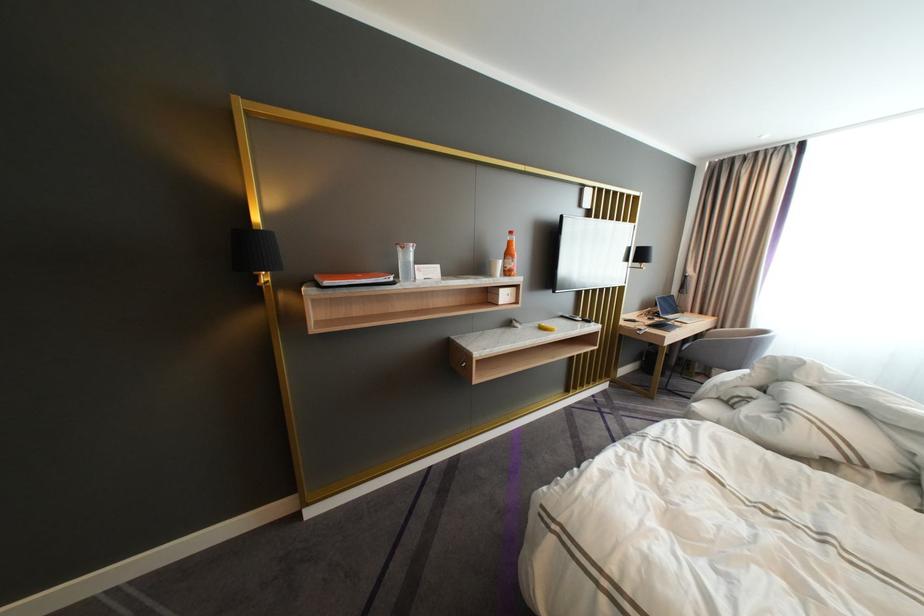
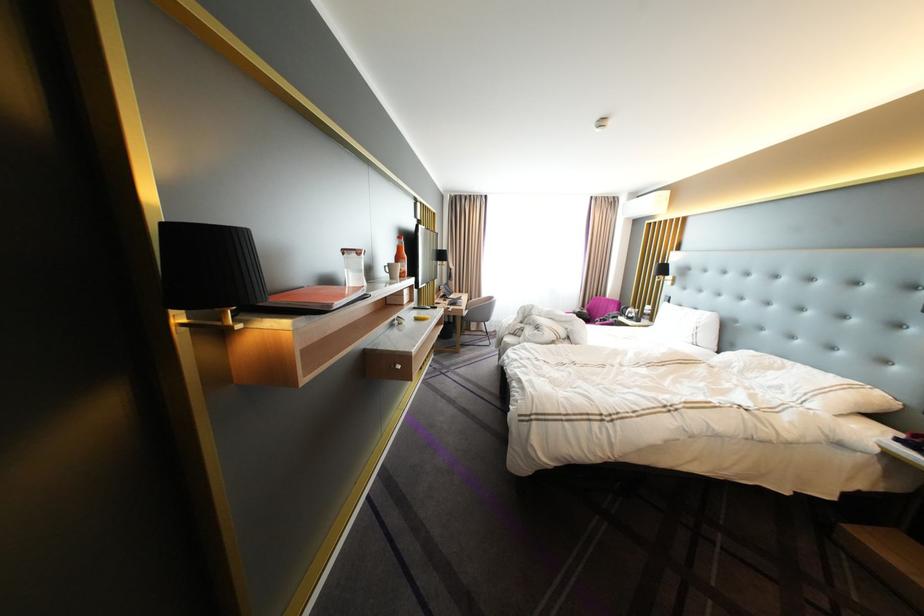
Where in the second image is the point corresponding to pixel 512 262 from the first image?

(411, 265)